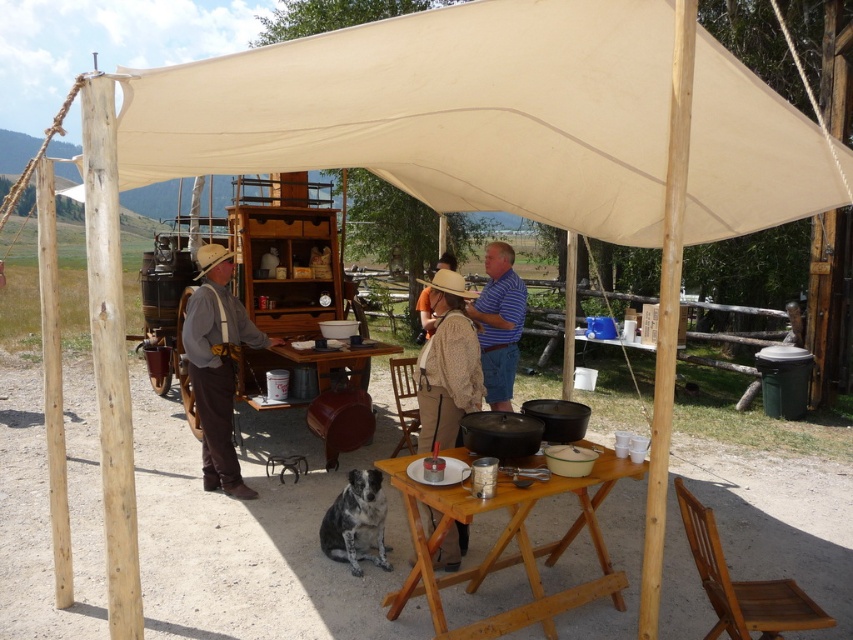
Consider the image. You are standing under the canopy and want to place a book on the brown leather hat at center without disturbing the wooden table at center. Is this possible?

The wooden table at center is located below the brown leather hat at center, so placing the book on the hat would not disturb the table as they are at different heights.

You are planning to set up a picnic under the beige canvas canopy at upper center. However, you notice the wooden table at center is already occupied. Can you place your picnic basket on the canopy without it getting in the way of the table?

The beige canvas canopy at upper center is positioned over the wooden table at center, so placing your picnic basket on the canopy would require careful placement to avoid obstructing the table below.

You are standing under the canopy and want to place a small decoration between the two points marked as point (699, 154) and point (199, 262). Which point should you move towards to place the decoration closer to the viewer?

To place the decoration closer to the viewer, you should move towards point (699, 154) because it is closer to the viewer compared to point (199, 262).